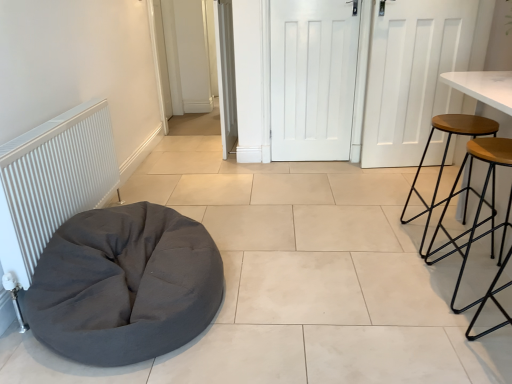
Question: From the image's perspective, is dark gray fabric bean bag at lower left positioned above or below wooden seat stool at right, acting as the second stool starting from the back?

Choices:
 (A) below
 (B) above

Answer: (A)

Question: Considering the positions of dark gray fabric bean bag at lower left and wooden seat stool at right, acting as the second stool starting from the back, in the image, is dark gray fabric bean bag at lower left taller or shorter than wooden seat stool at right, acting as the second stool starting from the back,?

Choices:
 (A) tall
 (B) short

Answer: (B)

Question: Which is nearer to the wooden seat stool at right, positioned as the second stool in front-to-back order?

Choices:
 (A) white matte door at center, positioned as the second door in right-to-left order
 (B) white matte door at center, positioned as the 3th door in right-to-left order
 (C) wooden seat stool at right, acting as the second stool starting from the back
 (D) white matte door at center, the 3th door in the left-to-right sequence
 (E) white ribbed radiator at left

Answer: (C)

Question: Considering the real-world distances, which object is farthest from the dark gray fabric bean bag at lower left?

Choices:
 (A) white matte door at center, the 3th door in the left-to-right sequence
 (B) white matte door at center, positioned as the 3th door in right-to-left order
 (C) white matte door at center, positioned as the second door in right-to-left order
 (D) wooden seat stool at right, which is the first stool in front-to-back order
 (E) white ribbed radiator at left

Answer: (A)